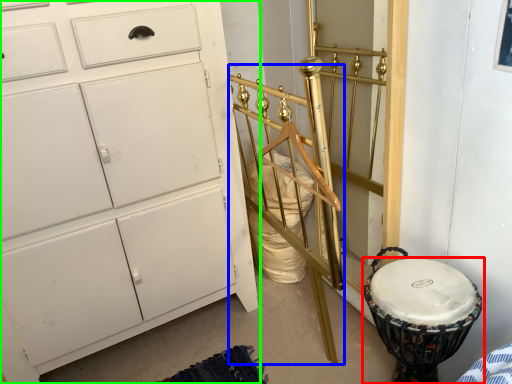
Question: Which object is positioned farthest from drum (highlighted by a red box)? Select from bed frame (highlighted by a blue box) and chest of drawers (highlighted by a green box).

Choices:
 (A) bed frame
 (B) chest of drawers

Answer: (B)